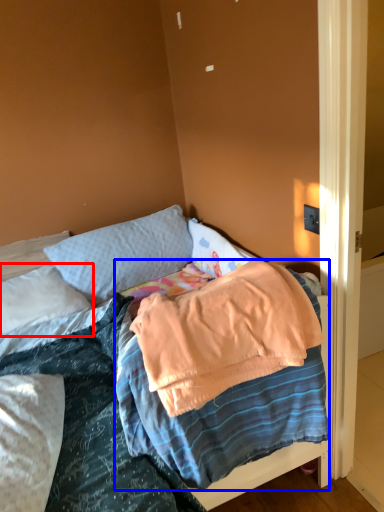
Question: Which object appears farthest to the camera in this image, pillow (highlighted by a red box) or blanket (highlighted by a blue box)?

Choices:
 (A) pillow
 (B) blanket

Answer: (A)